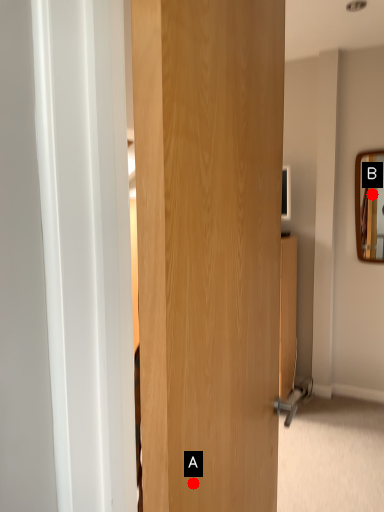
Question: Two points are circled on the image, labeled by A and B beside each circle. Among these points, which one is farthest from the camera?

Choices:
 (A) A is further
 (B) B is further

Answer: (B)